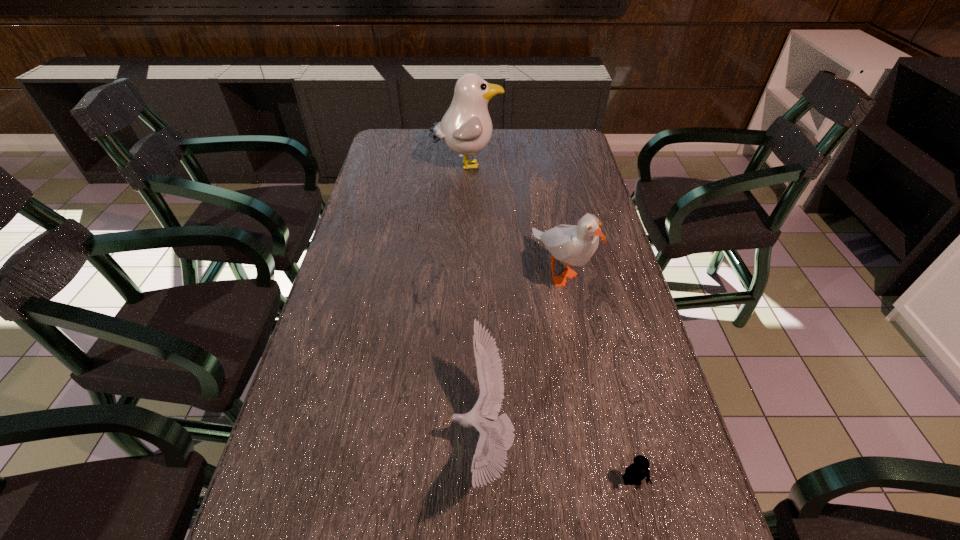
The image size is (960, 540). I want to click on the tallest gull, so click(466, 128).

Where is `the tallest object`? the tallest object is located at coordinates (466, 128).

Locate an element on the screen. the third shortest object is located at coordinates (575, 245).

Where is `the second farthest object`? The height and width of the screenshot is (540, 960). the second farthest object is located at coordinates (575, 245).

This screenshot has width=960, height=540. I want to click on the nearest gull, so click(497, 435).

At what (x,y) coordinates should I click in order to perform the action: click on the third tallest object. Please return your answer as a coordinate pair (x, y). Looking at the image, I should click on (497, 435).

You are a GUI agent. You are given a task and a screenshot of the screen. Output one action in this format:
    pyautogui.click(x=<x>, y=<y>)
    Task: Click on the shortest object
    
    Given the screenshot: What is the action you would take?
    pyautogui.click(x=637, y=471)

You are a GUI agent. You are given a task and a screenshot of the screen. Output one action in this format:
    pyautogui.click(x=<x>, y=<y>)
    Task: Click on the free space located 0.200m on the beak of the tallest object
    
    Given the screenshot: What is the action you would take?
    pyautogui.click(x=558, y=165)

What are the coordinates of `free location located 0.380m at the beak of the rightmost gull` in the screenshot? It's located at (594, 457).

Locate an element on the screen. vacant region located at the tip of the beak of the second shortest object is located at coordinates (324, 437).